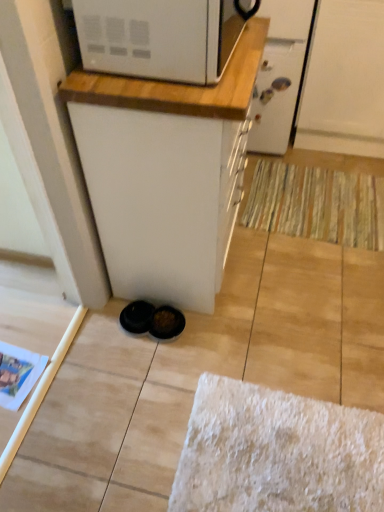
In the scene shown: In order to face white glossy screen door at upper center, which ranks as the second screen door in right-to-left order, should I rotate leftwards or rightwards?

Turn right by 11.106 degrees to look at white glossy screen door at upper center, which ranks as the second screen door in right-to-left order.

At what (x,y) coordinates should I click in order to perform the action: click on striped fabric doormat at lower right. Please return your answer as a coordinate pair (x, y). The height and width of the screenshot is (512, 384). Looking at the image, I should click on (317, 204).

The image size is (384, 512). Describe the element at coordinates (317, 204) in the screenshot. I see `striped fabric doormat at lower right` at that location.

In order to click on white matte screen door at upper right, which is the 1th screen door from right to left in this screenshot , I will do point(344,80).

What is the approximate width of white wood countertop at upper center?

white wood countertop at upper center is 17.09 inches in width.

The image size is (384, 512). In order to click on white matte cabinet at center in this screenshot , I will do `click(165, 173)`.

From a real-world perspective, is white wood countertop at upper center physically located above or below white glossy screen door at upper center, positioned as the 1th screen door in left-to-right order?

From a real-world perspective, white wood countertop at upper center is physically above white glossy screen door at upper center, positioned as the 1th screen door in left-to-right order.

Is white wood countertop at upper center wider than white glossy screen door at upper center, which ranks as the second screen door in right-to-left order?

In fact, white wood countertop at upper center might be narrower than white glossy screen door at upper center, which ranks as the second screen door in right-to-left order.

Is white wood countertop at upper center shorter than white glossy screen door at upper center, positioned as the 1th screen door in left-to-right order?

Yes.

Is white wood countertop at upper center in front of or behind white glossy screen door at upper center, which ranks as the second screen door in right-to-left order, in the image?

white wood countertop at upper center is in front of white glossy screen door at upper center, which ranks as the second screen door in right-to-left order.

In the scene shown: Is white glossy screen door at upper center, positioned as the 1th screen door in left-to-right order, placed right next to white matte cabinet at center?

There is a gap between white glossy screen door at upper center, positioned as the 1th screen door in left-to-right order, and white matte cabinet at center.

Relative to white matte cabinet at center, is white glossy screen door at upper center, which ranks as the second screen door in right-to-left order, in front or behind?

A: Clearly, white glossy screen door at upper center, which ranks as the second screen door in right-to-left order, is behind white matte cabinet at center.

There is a white glossy screen door at upper center, which ranks as the second screen door in right-to-left order. What are the coordinates of `cabinetry above it (from a real-world perspective)` in the screenshot? It's located at (165, 173).

How many degrees apart are the facing directions of white glossy screen door at upper center, which ranks as the second screen door in right-to-left order, and white matte cabinet at center?

89.7 degrees separate the facing orientations of white glossy screen door at upper center, which ranks as the second screen door in right-to-left order, and white matte cabinet at center.

Does white glossy screen door at upper center, which ranks as the second screen door in right-to-left order, have a greater width compared to white wood countertop at upper center?

Correct, the width of white glossy screen door at upper center, which ranks as the second screen door in right-to-left order, exceeds that of white wood countertop at upper center.

Is white glossy screen door at upper center, positioned as the 1th screen door in left-to-right order, next to white wood countertop at upper center and touching it?

No, white glossy screen door at upper center, positioned as the 1th screen door in left-to-right order, is not beside white wood countertop at upper center.

Is white glossy screen door at upper center, positioned as the 1th screen door in left-to-right order, not inside white wood countertop at upper center?

Yes, white glossy screen door at upper center, positioned as the 1th screen door in left-to-right order, is outside of white wood countertop at upper center.

From the picture: Considering the relative positions of white glossy screen door at upper center, positioned as the 1th screen door in left-to-right order, and white wood countertop at upper center in the image provided, is white glossy screen door at upper center, positioned as the 1th screen door in left-to-right order, in front of white wood countertop at upper center?

No.

Which of these two, striped fabric doormat at lower right or white matte screen door at upper right, which is the 1th screen door from right to left, is bigger?

Bigger between the two is white matte screen door at upper right, which is the 1th screen door from right to left.

Can white matte screen door at upper right, which is the 1th screen door from right to left, be found inside striped fabric doormat at lower right?

Definitely not — white matte screen door at upper right, which is the 1th screen door from right to left, is not inside striped fabric doormat at lower right.

Is striped fabric doormat at lower right facing towards white matte screen door at upper right, which is the 1th screen door from right to left?

No, striped fabric doormat at lower right is not aimed at white matte screen door at upper right, which is the 1th screen door from right to left.

Considering the sizes of striped fabric doormat at lower right and white matte screen door at upper right, placed as the 2th screen door when sorted from left to right, in the image, is striped fabric doormat at lower right taller or shorter than white matte screen door at upper right, placed as the 2th screen door when sorted from left to right,?

In the image, striped fabric doormat at lower right appears to be shorter than white matte screen door at upper right, placed as the 2th screen door when sorted from left to right.

Can you confirm if white matte cabinet at center is positioned to the right of white glossy screen door at upper center, which ranks as the second screen door in right-to-left order?

In fact, white matte cabinet at center is to the left of white glossy screen door at upper center, which ranks as the second screen door in right-to-left order.

Can you confirm if white matte cabinet at center is smaller than white glossy screen door at upper center, which ranks as the second screen door in right-to-left order?

No.

Are white matte cabinet at center and white glossy screen door at upper center, which ranks as the second screen door in right-to-left order, far apart?

Yes, white matte cabinet at center and white glossy screen door at upper center, which ranks as the second screen door in right-to-left order, are located far from each other.

Is white matte cabinet at center facing towards white glossy screen door at upper center, which ranks as the second screen door in right-to-left order?

No, white matte cabinet at center is not oriented towards white glossy screen door at upper center, which ranks as the second screen door in right-to-left order.

Would you say white wood countertop at upper center contains white matte screen door at upper right, which is the 1th screen door from right to left?

No, white matte screen door at upper right, which is the 1th screen door from right to left, is not inside white wood countertop at upper center.

Is white wood countertop at upper center shorter than white matte screen door at upper right, which is the 1th screen door from right to left?

Yes, white wood countertop at upper center is shorter than white matte screen door at upper right, which is the 1th screen door from right to left.

Does point (246, 108) come farther from viewer compared to point (382, 58)?

No, it is in front of (382, 58).

From the picture: From a real-world perspective, is white wood countertop at upper center on top of white matte screen door at upper right, which is the 1th screen door from right to left?

Yes.

Considering the sizes of white wood countertop at upper center and white matte cabinet at center in the image, is white wood countertop at upper center wider or thinner than white matte cabinet at center?

Considering their sizes, white wood countertop at upper center looks slimmer than white matte cabinet at center.

Consider the image. Is white wood countertop at upper center completely or partially outside of white matte cabinet at center?

Yes, white wood countertop at upper center is outside of white matte cabinet at center.

Consider the image. Is white wood countertop at upper center far from white matte cabinet at center?

white wood countertop at upper center is near white matte cabinet at center, not far away.

Is white matte cabinet at center at the back of white wood countertop at upper center?

No, white wood countertop at upper center is not facing away from white matte cabinet at center.

Find the location of a particular element. This screenshot has height=512, width=384. screen door that is the 1st object to the right of the white wood countertop at upper center, starting at the anchor is located at coordinates pyautogui.click(x=279, y=74).

At what (x,y) coordinates should I click in order to perform the action: click on the 2nd screen door behind the white matte cabinet at center, starting your count from the anchor. Please return your answer as a coordinate pair (x, y). The image size is (384, 512). Looking at the image, I should click on (279, 74).

When comparing their distances from striped fabric doormat at lower right, does white glossy screen door at upper center, which ranks as the second screen door in right-to-left order, or white wood countertop at upper center seem closer?

white glossy screen door at upper center, which ranks as the second screen door in right-to-left order, is closer to striped fabric doormat at lower right.

From the image, which object appears to be nearer to white matte screen door at upper right, placed as the 2th screen door when sorted from left to right, striped fabric doormat at lower right or white glossy screen door at upper center, positioned as the 1th screen door in left-to-right order?

Based on the image, white glossy screen door at upper center, positioned as the 1th screen door in left-to-right order, appears to be nearer to white matte screen door at upper right, placed as the 2th screen door when sorted from left to right.

Looking at the image, which one is located further to white matte screen door at upper right, placed as the 2th screen door when sorted from left to right, white glossy screen door at upper center, positioned as the 1th screen door in left-to-right order, or striped fabric doormat at lower right?

The object further to white matte screen door at upper right, placed as the 2th screen door when sorted from left to right, is striped fabric doormat at lower right.

Estimate the real-world distances between objects in this image. Which object is closer to white wood countertop at upper center, white matte cabinet at center or white matte screen door at upper right, placed as the 2th screen door when sorted from left to right?

The object closer to white wood countertop at upper center is white matte cabinet at center.

Considering their positions, is white matte screen door at upper right, which is the 1th screen door from right to left, positioned further to white wood countertop at upper center than striped fabric doormat at lower right?

Among the two, white matte screen door at upper right, which is the 1th screen door from right to left, is located further to white wood countertop at upper center.

Which object lies nearer to the anchor point white matte cabinet at center, white glossy screen door at upper center, which ranks as the second screen door in right-to-left order, or striped fabric doormat at lower right?

striped fabric doormat at lower right is positioned closer to the anchor white matte cabinet at center.

Which object lies nearer to the anchor point white matte cabinet at center, white wood countertop at upper center or white matte screen door at upper right, placed as the 2th screen door when sorted from left to right?

Among the two, white wood countertop at upper center is located nearer to white matte cabinet at center.

Considering their positions, is white matte screen door at upper right, which is the 1th screen door from right to left, positioned further to striped fabric doormat at lower right than white glossy screen door at upper center, positioned as the 1th screen door in left-to-right order?

white matte screen door at upper right, which is the 1th screen door from right to left, is further to striped fabric doormat at lower right.

Locate an element on the screen. screen door between white glossy screen door at upper center, which ranks as the second screen door in right-to-left order, and striped fabric doormat at lower right vertically is located at coordinates (344, 80).

Identify the location of cabinetry between white wood countertop at upper center and white glossy screen door at upper center, positioned as the 1th screen door in left-to-right order, in the front-back direction. (165, 173).

I want to click on screen door between white wood countertop at upper center and white glossy screen door at upper center, positioned as the 1th screen door in left-to-right order, from front to back, so click(344, 80).

Locate an element on the screen. The height and width of the screenshot is (512, 384). screen door between white matte cabinet at center and white matte screen door at upper right, placed as the 2th screen door when sorted from left to right, in the horizontal direction is located at coordinates (279, 74).